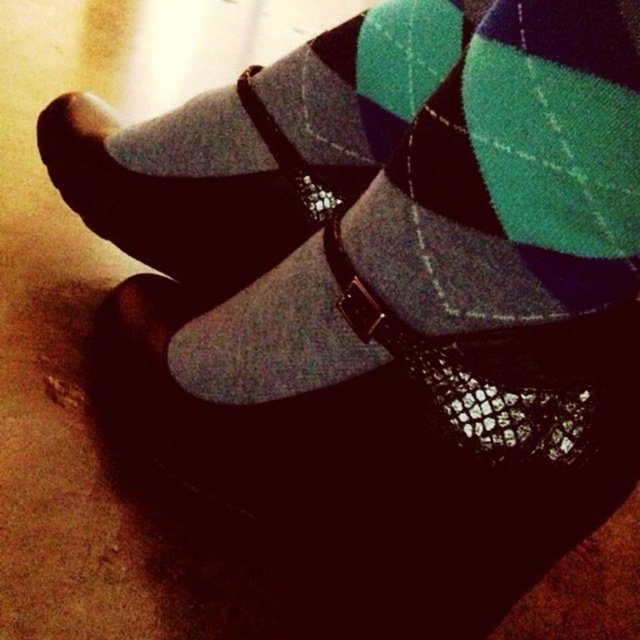
Does point (620, 272) lie in front of point (292, 211)?

Yes, it is.

Looking at this image, is argyle wool sock at center closer to the viewer compared to matte black socks at center?

That is True.

Locate an element on the screen. Image resolution: width=640 pixels, height=640 pixels. argyle wool sock at center is located at coordinates (493, 160).